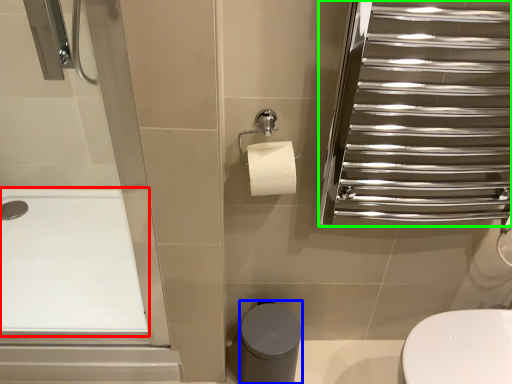
Question: Which is farther away from bath (highlighted by a red box)? bidet (highlighted by a blue box) or screen door (highlighted by a green box)?

Choices:
 (A) bidet
 (B) screen door

Answer: (B)